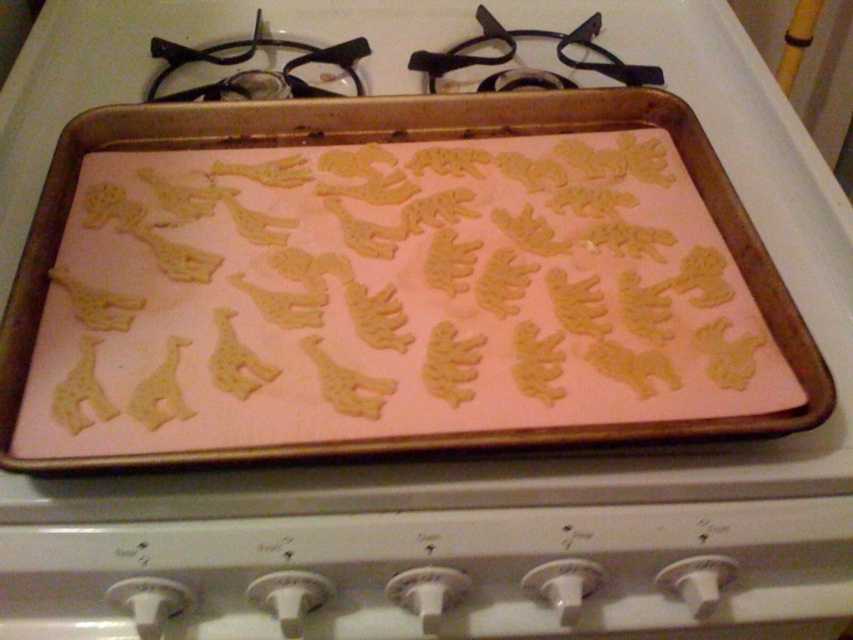
Between point (723, 429) and point (511, 48), which one is positioned in front?

Positioned in front is point (723, 429).

Does golden brown cookie sheet at center have a greater height compared to black metal gas stove at upper center?

Correct, golden brown cookie sheet at center is much taller as black metal gas stove at upper center.

Does point (672, 252) lie behind point (177, 45)?

No, it is not.

The height and width of the screenshot is (640, 853). Find the location of `golden brown cookie sheet at center`. golden brown cookie sheet at center is located at coordinates (392, 284).